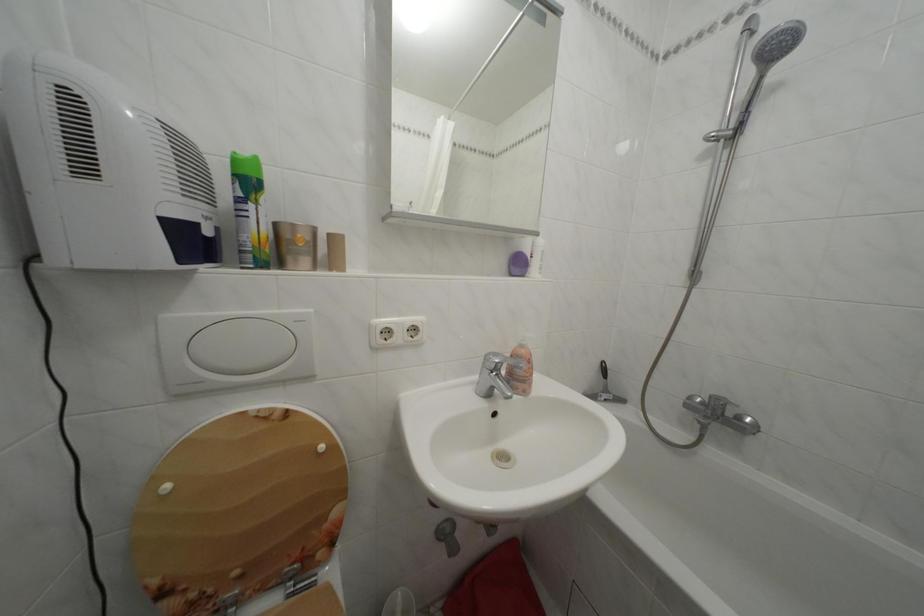
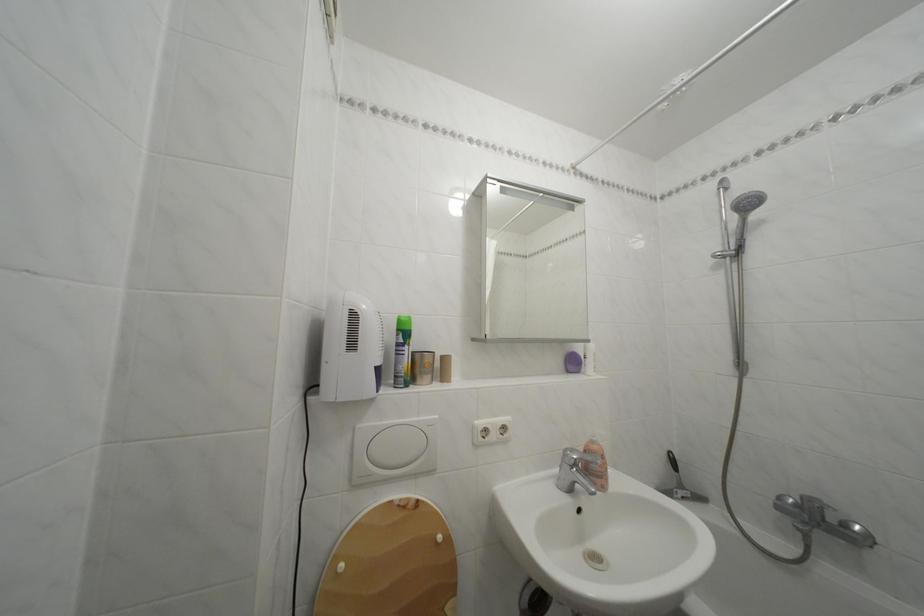
The point at (176, 493) is marked in the first image. Where is the corresponding point in the second image?

(350, 573)